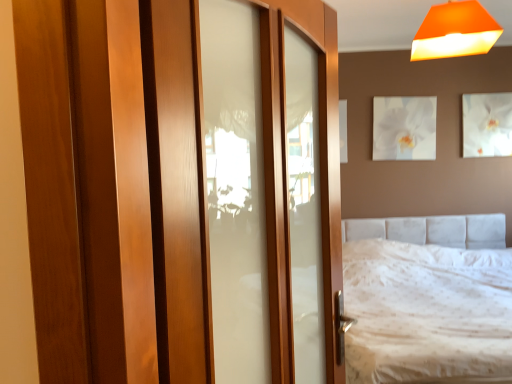
Question: Does orange matte lampshade at upper right have a greater height compared to white glossy picture frame at upper center, placed as the 2th picture frame when sorted from right to left?

Choices:
 (A) no
 (B) yes

Answer: (A)

Question: From a real-world perspective, is orange matte lampshade at upper right located higher than white glossy picture frame at upper center, the 1th picture frame when ordered from left to right?

Choices:
 (A) yes
 (B) no

Answer: (A)

Question: Would you say orange matte lampshade at upper right is a long distance from white glossy picture frame at upper center, the 1th picture frame when ordered from left to right?

Choices:
 (A) yes
 (B) no

Answer: (A)

Question: Is orange matte lampshade at upper right turned away from white glossy picture frame at upper center, placed as the 2th picture frame when sorted from right to left?

Choices:
 (A) no
 (B) yes

Answer: (B)

Question: Does orange matte lampshade at upper right have a lesser width compared to white glossy picture frame at upper center, placed as the 2th picture frame when sorted from right to left?

Choices:
 (A) no
 (B) yes

Answer: (A)

Question: Does orange matte lampshade at upper right contain white glossy picture frame at upper center, placed as the 2th picture frame when sorted from right to left?

Choices:
 (A) yes
 (B) no

Answer: (B)

Question: Is white glossy picture frame at upper center, placed as the 2th picture frame when sorted from right to left, facing towards white textured bed at center?

Choices:
 (A) no
 (B) yes

Answer: (A)

Question: Is white textured bed at center at the back of white glossy picture frame at upper center, the 1th picture frame when ordered from left to right?

Choices:
 (A) yes
 (B) no

Answer: (B)

Question: Is white glossy picture frame at upper center, the 1th picture frame when ordered from left to right, positioned before white textured bed at center?

Choices:
 (A) yes
 (B) no

Answer: (B)

Question: From the image's perspective, is white glossy picture frame at upper center, the 1th picture frame when ordered from left to right, below white textured bed at center?

Choices:
 (A) no
 (B) yes

Answer: (A)

Question: Does white glossy picture frame at upper center, placed as the 2th picture frame when sorted from right to left, have a greater height compared to white textured bed at center?

Choices:
 (A) yes
 (B) no

Answer: (B)

Question: Considering the relative sizes of white glossy picture frame at upper center, placed as the 2th picture frame when sorted from right to left, and white textured bed at center in the image provided, is white glossy picture frame at upper center, placed as the 2th picture frame when sorted from right to left, wider than white textured bed at center?

Choices:
 (A) yes
 (B) no

Answer: (B)

Question: Is white textured bed at center positioned beyond the bounds of wooden door at center?

Choices:
 (A) no
 (B) yes

Answer: (B)